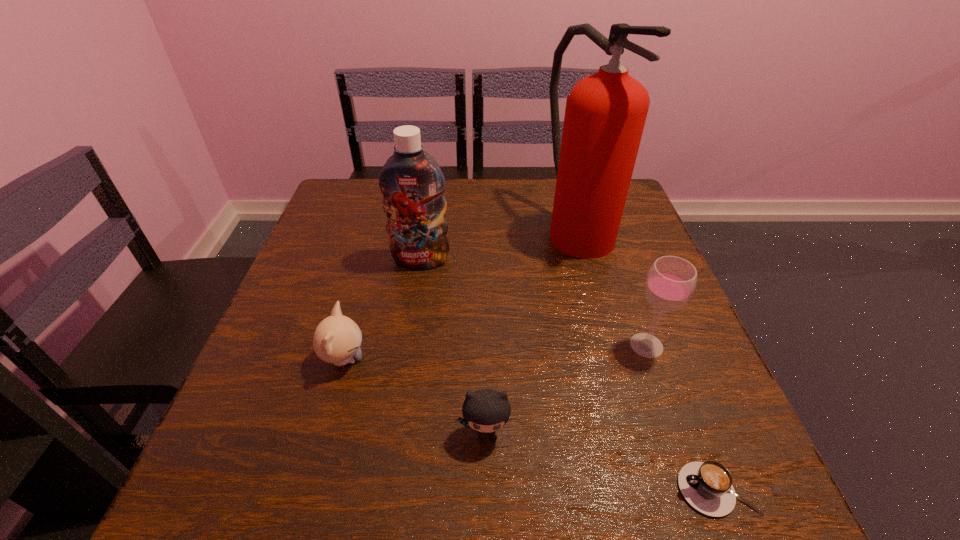
Where is `free space that is in between the nearer kitten and the wineglass`? This screenshot has height=540, width=960. free space that is in between the nearer kitten and the wineglass is located at coordinates (x=566, y=389).

At what (x,y) coordinates should I click in order to perform the action: click on vacant space that's between the cappuccino and the second object from left to right. Please return your answer as a coordinate pair (x, y). Looking at the image, I should click on 568,375.

Where is `object that stands as the fifth closest to the leftmost object`? object that stands as the fifth closest to the leftmost object is located at coordinates (707, 486).

Where is `object that is the third nearest to the nearest object`? object that is the third nearest to the nearest object is located at coordinates [x=605, y=114].

Where is `vacant area in the image that satisfies the following two spatial constraints: 1. on the front label of the fourth shortest object; 2. on the right side of the fifth object from right to left`? This screenshot has height=540, width=960. vacant area in the image that satisfies the following two spatial constraints: 1. on the front label of the fourth shortest object; 2. on the right side of the fifth object from right to left is located at coordinates (408, 345).

Identify the location of free spot that satisfies the following two spatial constraints: 1. on the front label of the shampoo; 2. on the face of the leftmost object. The image size is (960, 540). (405, 359).

This screenshot has height=540, width=960. What are the coordinates of `free space that satisfies the following two spatial constraints: 1. on the front label of the second tallest object; 2. on the face of the farther kitten` in the screenshot? It's located at (405, 359).